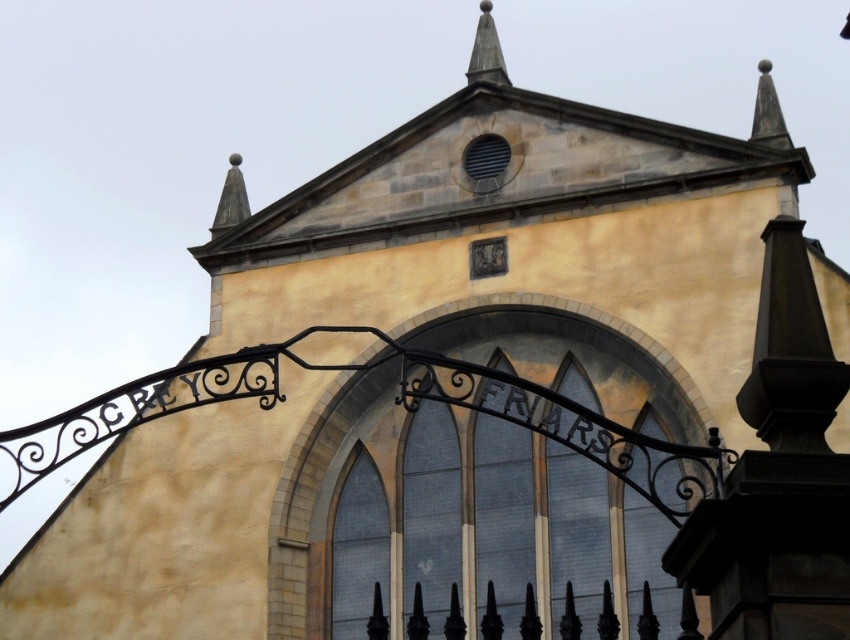
Question: Is the position of smooth gray spire at upper center more distant than that of matte stone spire at upper center?

Choices:
 (A) no
 (B) yes

Answer: (A)

Question: Is the position of smooth gray spire at upper center more distant than that of matte stone spire at upper center?

Choices:
 (A) yes
 (B) no

Answer: (B)

Question: Is smooth gray spire at upper center wider than matte stone spire at upper center?

Choices:
 (A) no
 (B) yes

Answer: (A)